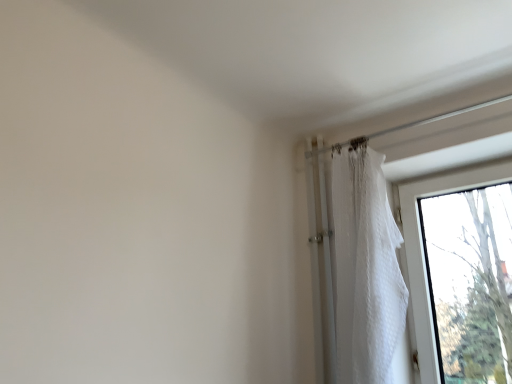
Question: Can you confirm if transparent glass window at right is smaller than white textured curtain at right?

Choices:
 (A) no
 (B) yes

Answer: (A)

Question: Is transparent glass window at right facing towards white textured curtain at right?

Choices:
 (A) yes
 (B) no

Answer: (A)

Question: Is there a large distance between transparent glass window at right and white textured curtain at right?

Choices:
 (A) yes
 (B) no

Answer: (B)

Question: From the image's perspective, is transparent glass window at right under white textured curtain at right?

Choices:
 (A) yes
 (B) no

Answer: (A)

Question: Is the position of transparent glass window at right more distant than that of white textured curtain at right?

Choices:
 (A) yes
 (B) no

Answer: (A)

Question: From a real-world perspective, is transparent glass window at right physically above white textured curtain at right?

Choices:
 (A) no
 (B) yes

Answer: (A)

Question: Considering the relative sizes of white textured curtain at right and transparent glass window at right in the image provided, is white textured curtain at right wider than transparent glass window at right?

Choices:
 (A) yes
 (B) no

Answer: (A)

Question: Is the position of white textured curtain at right less distant than that of transparent glass window at right?

Choices:
 (A) yes
 (B) no

Answer: (A)

Question: Is white textured curtain at right behind transparent glass window at right?

Choices:
 (A) no
 (B) yes

Answer: (A)

Question: From a real-world perspective, is white textured curtain at right below transparent glass window at right?

Choices:
 (A) no
 (B) yes

Answer: (A)

Question: Considering the relative positions of white textured curtain at right and transparent glass window at right in the image provided, is white textured curtain at right to the left of transparent glass window at right from the viewer's perspective?

Choices:
 (A) yes
 (B) no

Answer: (A)

Question: Would you say transparent glass window at right is part of white textured curtain at right's contents?

Choices:
 (A) no
 (B) yes

Answer: (A)

Question: From the image's perspective, relative to white textured curtain at right, is transparent glass window at right above or below?

Choices:
 (A) above
 (B) below

Answer: (B)